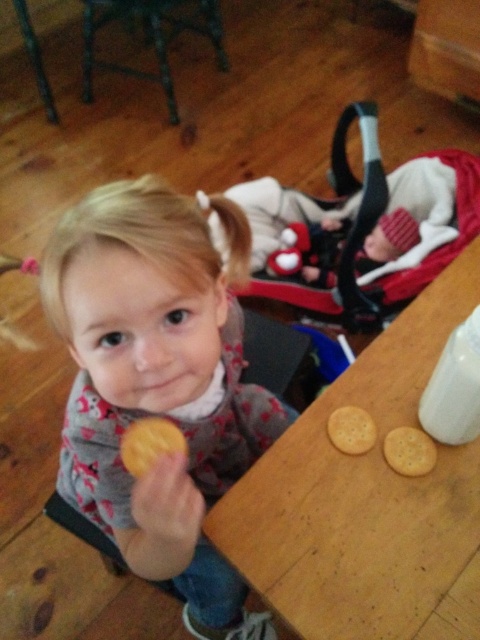
Find the location of a particular element. This screenshot has width=480, height=640. matte pink shirt at center is located at coordinates (158, 384).

This screenshot has width=480, height=640. What do you see at coordinates (158, 384) in the screenshot?
I see `matte pink shirt at center` at bounding box center [158, 384].

What are the coordinates of `matte pink shirt at center` in the screenshot? It's located at (158, 384).

Does wooden table at center come in front of white matte bottle at upper right?

Yes, it is.

In the scene shown: Can you confirm if wooden table at center is smaller than white matte bottle at upper right?

No.

In order to click on wooden table at center in this screenshot , I will do `click(364, 497)`.

Is white matte bottle at upper right thinner than yellow matte cookie at center?

Indeed, white matte bottle at upper right has a lesser width compared to yellow matte cookie at center.

Who is more distant from viewer, (448, 436) or (178, 433)?

Positioned behind is point (448, 436).

Based on the photo, who is more forward, (468, 333) or (149, 458)?

Point (149, 458) is more forward.

Identify the location of white matte bottle at upper right. (455, 387).